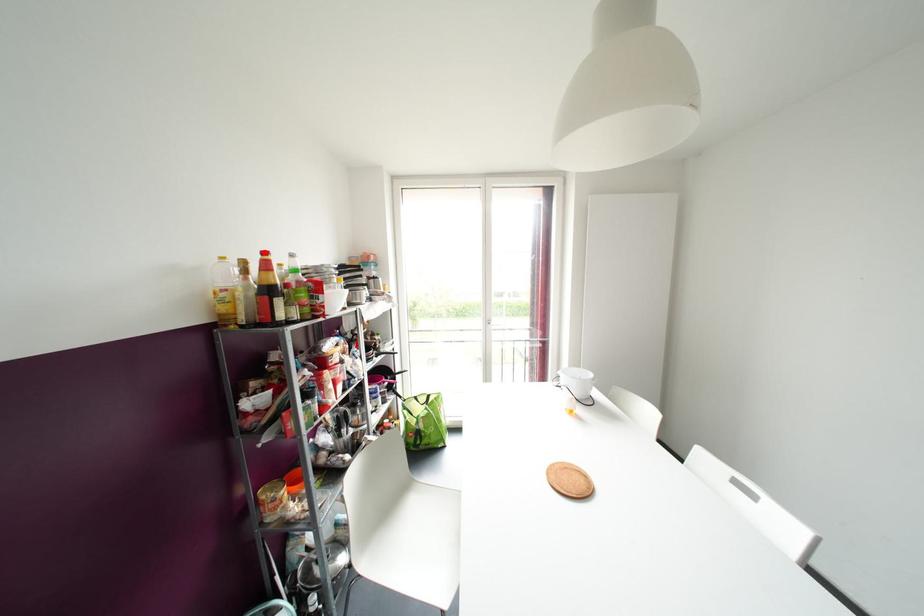
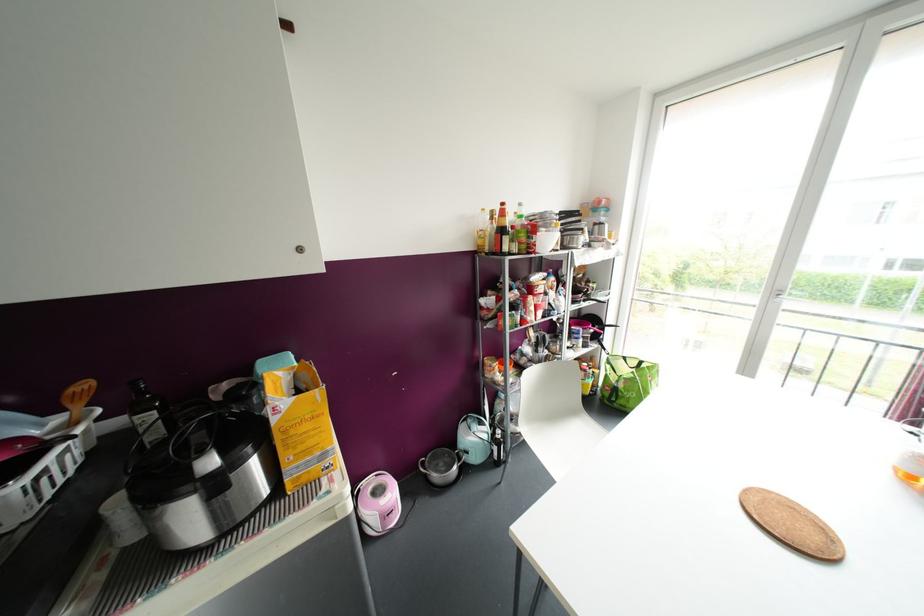
Find the pixel in the second image that matches the highlighted location in the first image.

(502, 204)